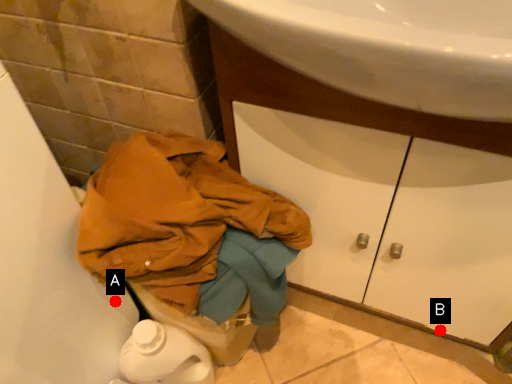
Question: Two points are circled on the image, labeled by A and B beside each circle. Which point is farther from the camera taking this photo?

Choices:
 (A) A is further
 (B) B is further

Answer: (B)